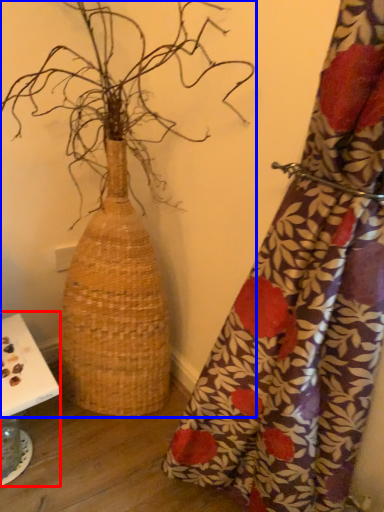
Question: Which object is further to the camera taking this photo, table (highlighted by a red box) or houseplant (highlighted by a blue box)?

Choices:
 (A) table
 (B) houseplant

Answer: (A)